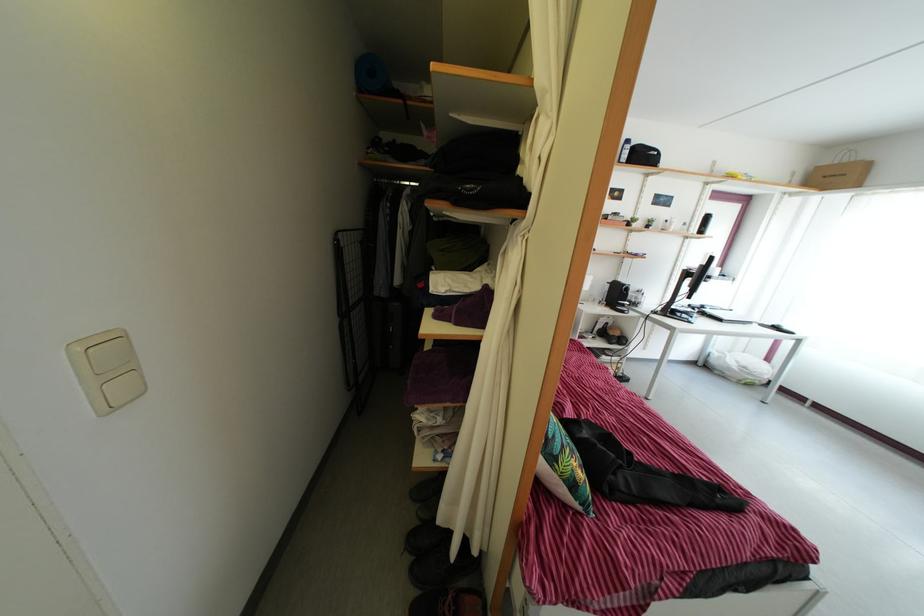
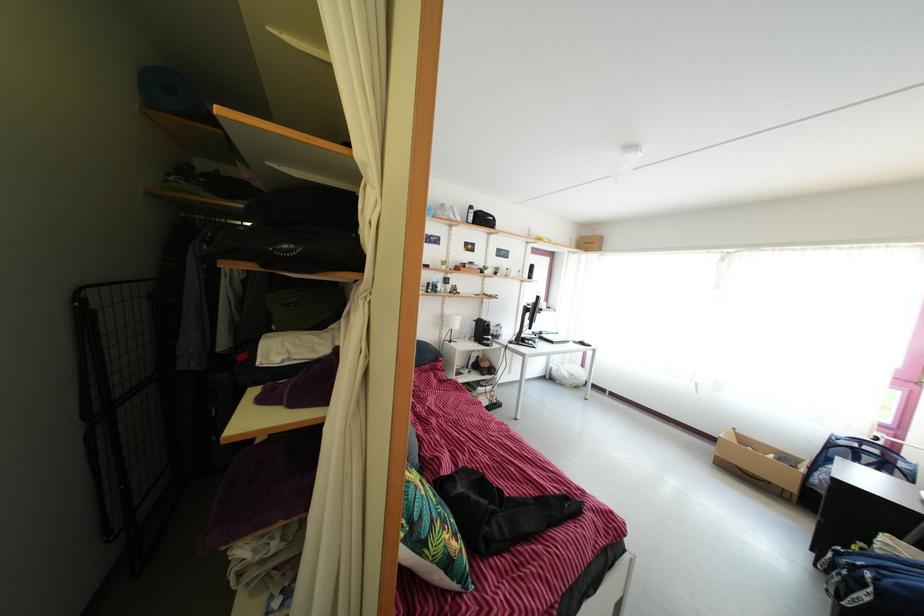
Question: The first image is from the beginning of the video and the second image is from the end. How did the camera likely rotate when shooting the video?

Choices:
 (A) Left
 (B) Right
 (C) Up
 (D) Down

Answer: (B)